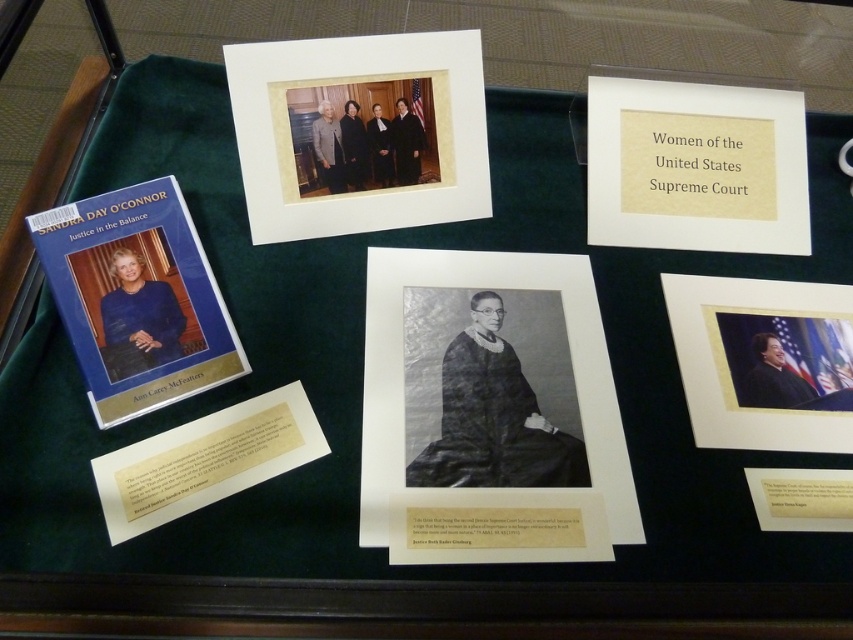
Question: Can you confirm if beige paper at upper center is positioned to the right of matte gold photo frame at lower right?

Choices:
 (A) no
 (B) yes

Answer: (A)

Question: Can you confirm if black paper at center is positioned below beige paper at upper center?

Choices:
 (A) yes
 (B) no

Answer: (A)

Question: Which of the following is the farthest from the observer?

Choices:
 (A) black paper at center
 (B) blue hardcover book at upper left
 (C) beige paper at upper center
 (D) matte paper photo frame at upper center

Answer: (C)

Question: Among these objects, which one is nearest to the camera?

Choices:
 (A) matte gold photo frame at lower right
 (B) blue hardcover book at upper left

Answer: (B)

Question: Which of the following is the closest to the observer?

Choices:
 (A) (767, 104)
 (B) (334, 48)
 (C) (726, 420)
 (D) (88, 388)

Answer: (D)

Question: Is black paper at center smaller than matte gold photo frame at lower right?

Choices:
 (A) yes
 (B) no

Answer: (B)